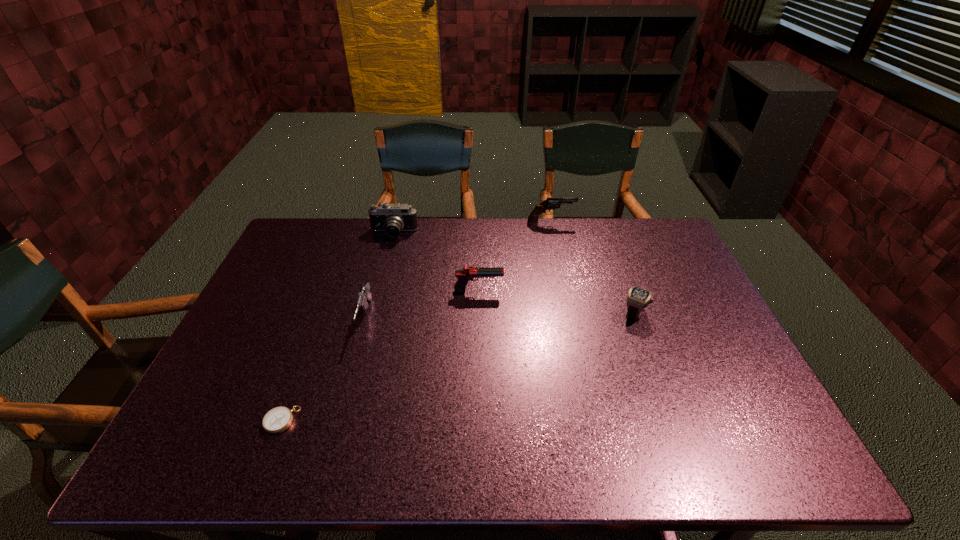
Where is `free space between the nearest object and the rightmost object`? free space between the nearest object and the rightmost object is located at coordinates (458, 367).

Locate an element on the screen. This screenshot has width=960, height=540. empty location between the leftmost object and the second farthest object is located at coordinates (338, 327).

This screenshot has height=540, width=960. I want to click on free point between the compass and the nearest gun, so click(x=324, y=369).

This screenshot has height=540, width=960. What are the coordinates of `object that is the fourth closest to the second gun from right to left` in the screenshot? It's located at (550, 203).

Identify which object is the fourth nearest to the fifth nearest object. Please provide its 2D coordinates. Your answer should be formatted as a tuple, i.e. [(x, y)], where the tuple contains the x and y coordinates of a point satisfying the conditions above.

[(278, 419)]

Locate an element on the screen. This screenshot has width=960, height=540. gun that can be found as the closest to the tallest gun is located at coordinates (467, 273).

In order to click on gun that is the closest to the camera in this screenshot , I will do `click(467, 273)`.

Locate an element on the screen. The height and width of the screenshot is (540, 960). blank area in the image that satisfies the following two spatial constraints: 1. along the barrel of the farthest object; 2. on the back side of the watch is located at coordinates point(570,313).

At what (x,y) coordinates should I click in order to perform the action: click on vacant position in the image that satisfies the following two spatial constraints: 1. at the aiming end of the second gun from right to left; 2. on the right side of the watch. Please return your answer as a coordinate pair (x, y). The height and width of the screenshot is (540, 960). Looking at the image, I should click on (479, 313).

Image resolution: width=960 pixels, height=540 pixels. What are the coordinates of `free space that satisfies the following two spatial constraints: 1. on the back side of the rightmost object; 2. along the barrel of the rightmost gun` in the screenshot? It's located at (601, 223).